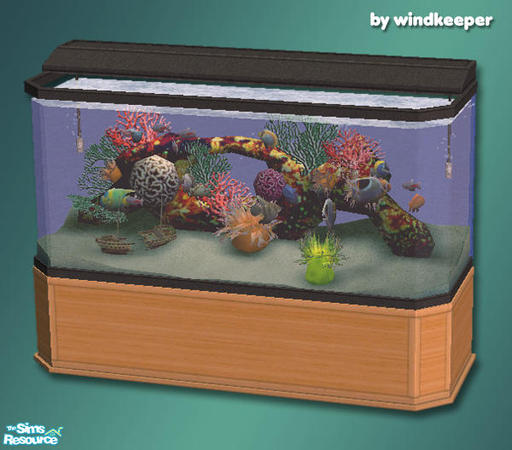
Locate an element on the screen. This screenshot has height=450, width=512. wood fish tank base is located at coordinates (323, 365).